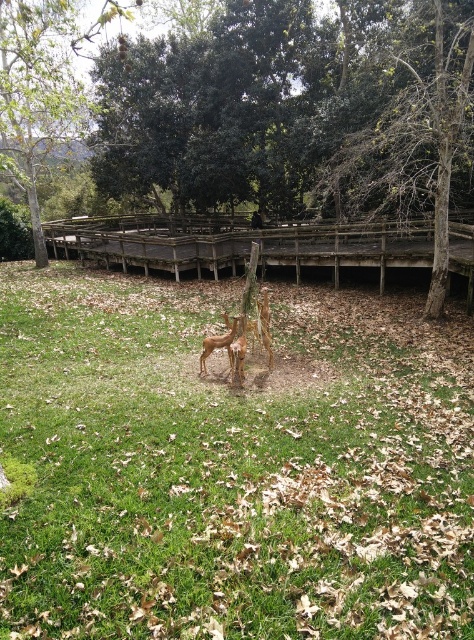
Question: Is weathered wood fence at center to the left of dark green textured tree at upper center from the viewer's perspective?

Choices:
 (A) yes
 (B) no

Answer: (A)

Question: Which point appears closest to the camera in this image?

Choices:
 (A) (468, 17)
 (B) (237, 314)
 (C) (116, 502)
 (D) (246, 227)

Answer: (C)

Question: Is green grass at center closer to the viewer compared to green leafy tree at upper center?

Choices:
 (A) yes
 (B) no

Answer: (A)

Question: Which is farther from the green leafy tree at upper center?

Choices:
 (A) brown textured deer at center
 (B) green grass at center
 (C) dark green textured tree at upper center
 (D) weathered wood fence at center

Answer: (A)

Question: Among these objects, which one is farthest from the camera?

Choices:
 (A) brown textured deer at center
 (B) weathered wood fence at center
 (C) green grass at center
 (D) dark green textured tree at upper center

Answer: (D)

Question: Is weathered wood fence at center above brown textured deer at center?

Choices:
 (A) no
 (B) yes

Answer: (B)